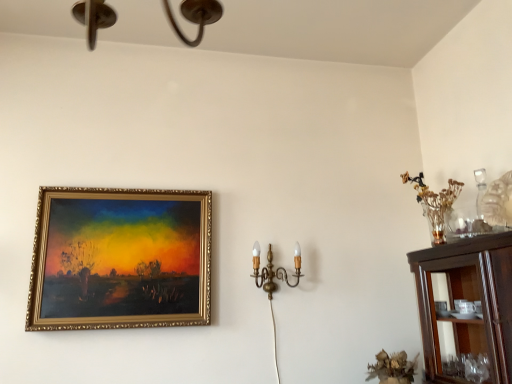
Question: Is there a large distance between gold ornate frame at upper left and gold brass wall sconce at center right?

Choices:
 (A) no
 (B) yes

Answer: (A)

Question: Could you tell me if gold ornate frame at upper left is facing gold brass wall sconce at center right?

Choices:
 (A) yes
 (B) no

Answer: (B)

Question: Is gold ornate frame at upper left shorter than gold brass wall sconce at center right?

Choices:
 (A) yes
 (B) no

Answer: (B)

Question: Considering the relative sizes of gold ornate frame at upper left and gold brass wall sconce at center right in the image provided, is gold ornate frame at upper left thinner than gold brass wall sconce at center right?

Choices:
 (A) no
 (B) yes

Answer: (B)

Question: From a real-world perspective, is gold ornate frame at upper left located higher than gold brass wall sconce at center right?

Choices:
 (A) yes
 (B) no

Answer: (A)

Question: Considering the relative positions of gold ornate frame at upper left and gold brass wall sconce at center right in the image provided, is gold ornate frame at upper left to the right of gold brass wall sconce at center right from the viewer's perspective?

Choices:
 (A) no
 (B) yes

Answer: (A)

Question: Is gold brass wall sconce at center right wider than dark wood cabinet at right?

Choices:
 (A) no
 (B) yes

Answer: (A)

Question: Is gold brass wall sconce at center right further to camera compared to dark wood cabinet at right?

Choices:
 (A) yes
 (B) no

Answer: (A)

Question: Considering the relative positions of gold brass wall sconce at center right and dark wood cabinet at right in the image provided, is gold brass wall sconce at center right to the left of dark wood cabinet at right from the viewer's perspective?

Choices:
 (A) yes
 (B) no

Answer: (A)

Question: Does gold brass wall sconce at center right turn towards dark wood cabinet at right?

Choices:
 (A) no
 (B) yes

Answer: (A)

Question: Is gold brass wall sconce at center right bigger than dark wood cabinet at right?

Choices:
 (A) no
 (B) yes

Answer: (A)

Question: Can you confirm if gold brass wall sconce at center right is smaller than dark wood cabinet at right?

Choices:
 (A) no
 (B) yes

Answer: (B)

Question: Is gold ornate frame at upper left taller than dark wood cabinet at right?

Choices:
 (A) no
 (B) yes

Answer: (B)